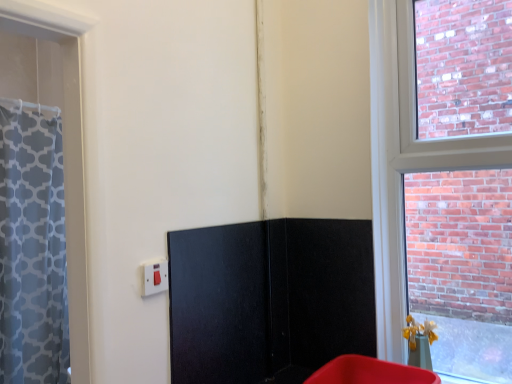
Question: Is point (199, 253) positioned closer to the camera than point (364, 360)?

Choices:
 (A) farther
 (B) closer

Answer: (B)

Question: Which is correct: black matte screen door at center is inside matte plastic bin at lower right, or outside of it?

Choices:
 (A) outside
 (B) inside

Answer: (A)

Question: Estimate the real-world distances between objects in this image. Which object is farther from the matte white switch at lower left?

Choices:
 (A) matte plastic bin at lower right
 (B) black matte screen door at center

Answer: (A)

Question: Which of these objects is positioned farthest from the matte white switch at lower left?

Choices:
 (A) black matte screen door at center
 (B) matte plastic bin at lower right

Answer: (B)